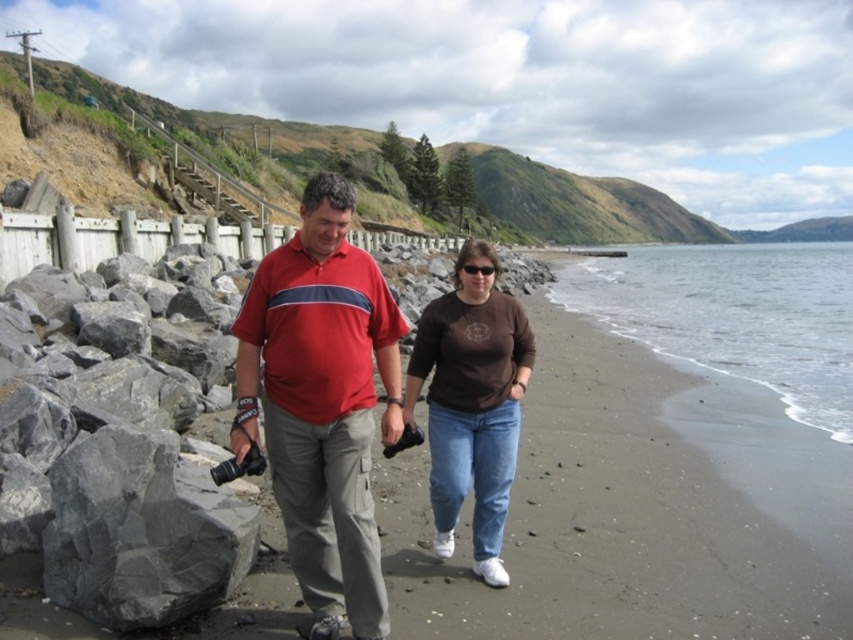
You are planning to set up a picnic area on the beach. Given the presence of the smooth sand beach at center and the gray sand at lower right, which area would you choose and why?

You should choose the gray sand at lower right because it occupies more space than the smooth sand beach at center, providing a larger area for the picnic setup.

You are standing at the beach and want to reach the wooden fence in the background. There is a point at coordinates point (67, 548) which is 7.56 meters away from you. Can you estimate how far you need to walk to reach the wooden fence?

The wooden fence is located in the background of the beach scene. The point at (67, 548) is 7.56 meters away from your current position. Since the wooden fence is in the background beyond this point, you would need to walk more than 7.56 meters to reach it.

You are standing on the beach and want to pick up the black plastic sunglasses at center. However, there is a gray rock at lower left in your way. Can you step over or around it to reach the sunglasses?

The gray rock at lower left is closer to the viewer than the black plastic sunglasses at center, so you can step over or around the gray rock at lower left to reach the black plastic sunglasses at center.